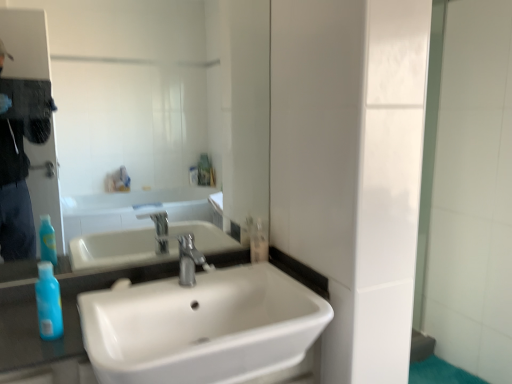
Question: Considering the relative sizes of white glossy sink at center and matte glass mirror at upper center in the image provided, is white glossy sink at center taller than matte glass mirror at upper center?

Choices:
 (A) yes
 (B) no

Answer: (B)

Question: From the image's perspective, is white glossy sink at center on top of matte glass mirror at upper center?

Choices:
 (A) yes
 (B) no

Answer: (B)

Question: Is white glossy sink at center oriented towards matte glass mirror at upper center?

Choices:
 (A) no
 (B) yes

Answer: (A)

Question: Does white glossy sink at center have a greater width compared to matte glass mirror at upper center?

Choices:
 (A) yes
 (B) no

Answer: (A)

Question: Considering the relative sizes of white glossy sink at center and matte glass mirror at upper center in the image provided, is white glossy sink at center shorter than matte glass mirror at upper center?

Choices:
 (A) yes
 (B) no

Answer: (A)

Question: Can you confirm if white glossy sink at center is thinner than matte glass mirror at upper center?

Choices:
 (A) no
 (B) yes

Answer: (A)

Question: From a real-world perspective, is silver metallic faucet at center below white glossy sink at center?

Choices:
 (A) yes
 (B) no

Answer: (B)

Question: Can you confirm if silver metallic faucet at center is taller than white glossy sink at center?

Choices:
 (A) yes
 (B) no

Answer: (B)

Question: Can you confirm if silver metallic faucet at center is positioned to the right of white glossy sink at center?

Choices:
 (A) no
 (B) yes

Answer: (A)

Question: Is silver metallic faucet at center facing away from white glossy sink at center?

Choices:
 (A) yes
 (B) no

Answer: (B)

Question: Is silver metallic faucet at center further to the viewer compared to white glossy sink at center?

Choices:
 (A) no
 (B) yes

Answer: (B)

Question: Can you confirm if silver metallic faucet at center is shorter than white glossy sink at center?

Choices:
 (A) yes
 (B) no

Answer: (A)

Question: From the image's perspective, does blue translucent bottle at lower left, the 2th mouthwash from the back, appear higher than white glossy sink at center?

Choices:
 (A) yes
 (B) no

Answer: (A)